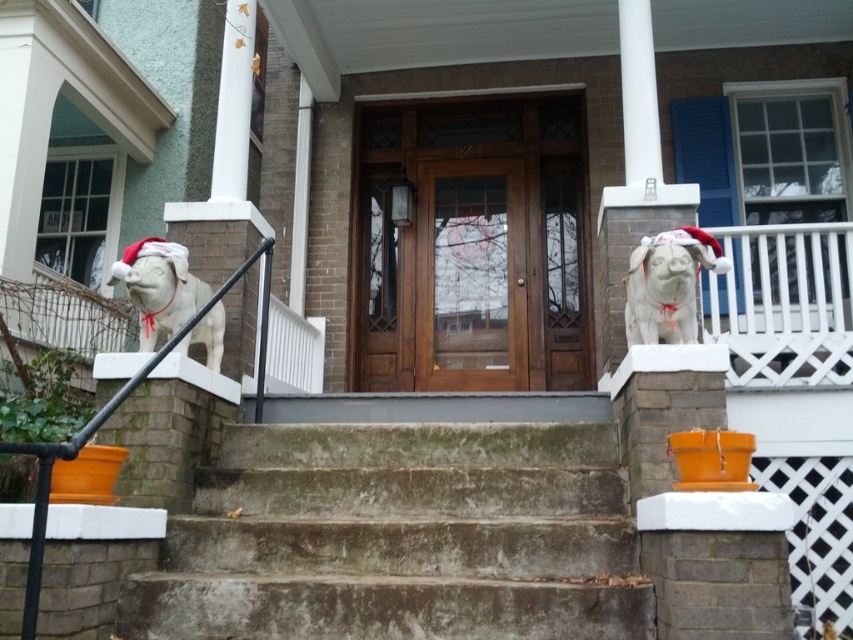
You are standing at the entrance of the house and want to place a small potted plant between the concrete steps at center and the white stone dog at center. Since you want the plant to be closer to the steps, where should you place it?

The concrete steps at center is closer to the viewer than the white stone dog at center, so you should place the plant between the concrete steps at center and the white stone dog at center but closer to the concrete steps at center to ensure it is nearer to them.

You are standing in front of the residential building entrance shown in the image. There is a point marked at coordinates (399, 538). What object is located at this point?

The concrete steps at center is located at point (399, 538).